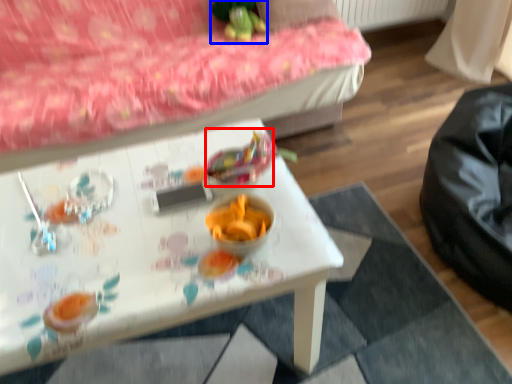
Question: Which of the following is the farthest to the observer, food (highlighted by a red box) or toy (highlighted by a blue box)?

Choices:
 (A) food
 (B) toy

Answer: (B)